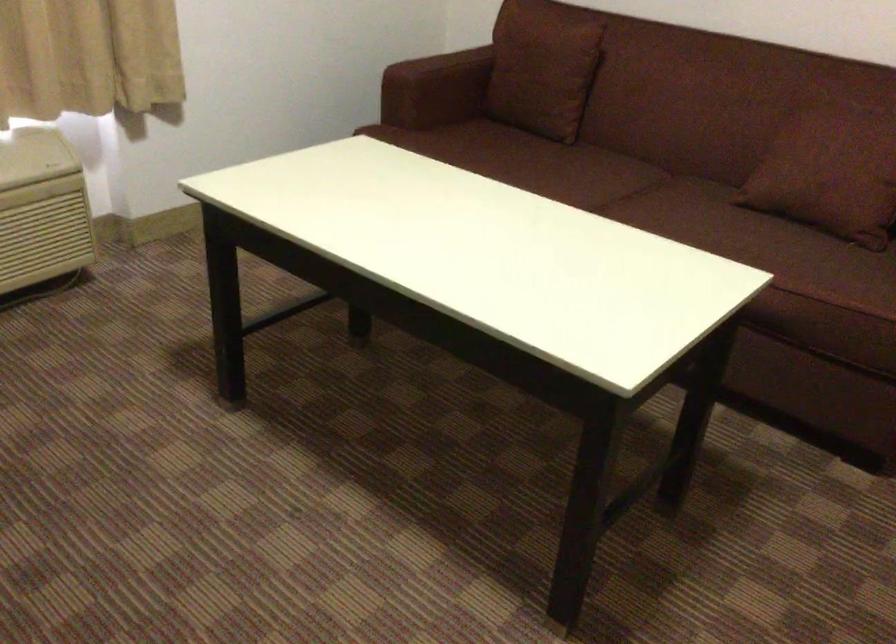
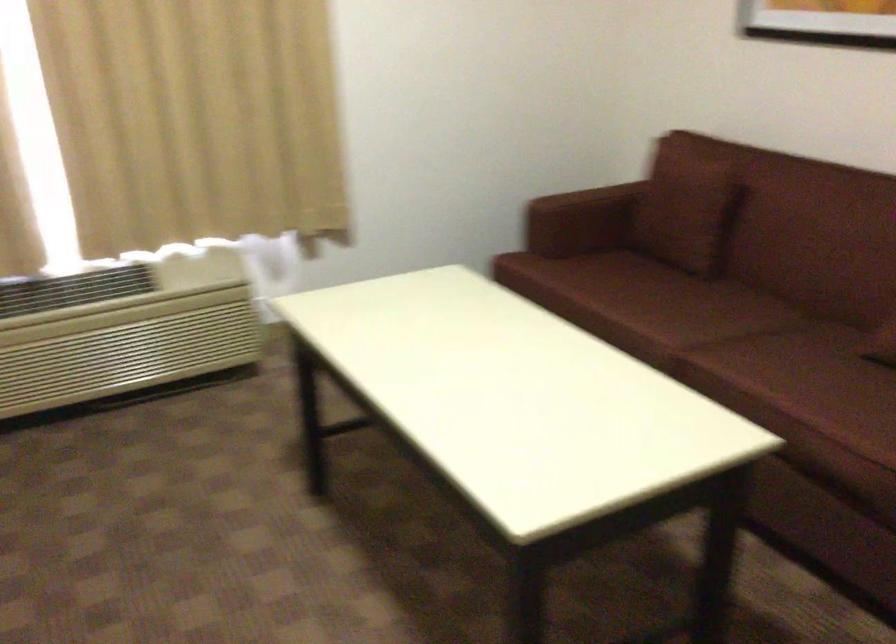
The point at [445,96] is marked in the first image. Where is the corresponding point in the second image?

(573, 225)